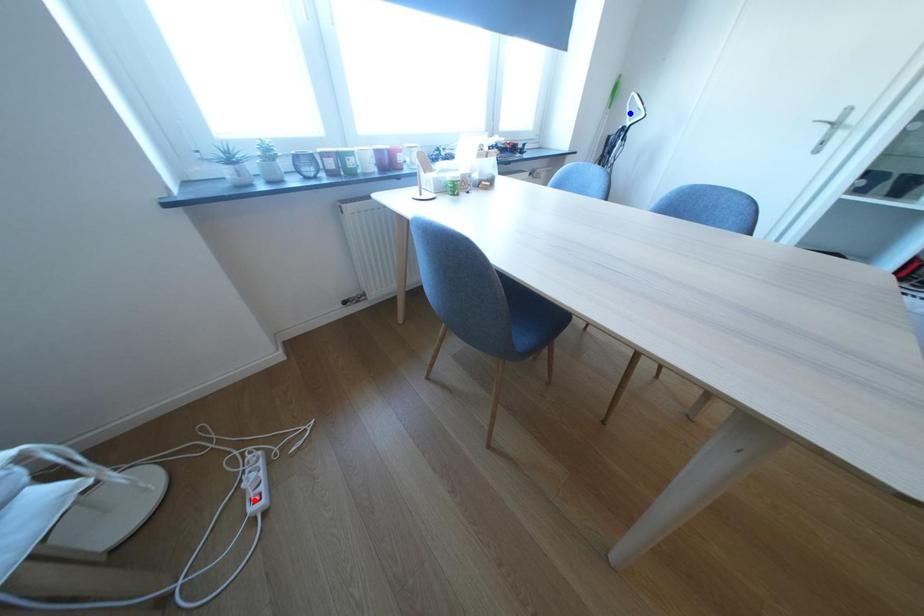
Question: In the image, two points are highlighted. Which point is nearer to the camera? Reply with the corresponding letter.

Choices:
 (A) blue point
 (B) red point

Answer: (B)